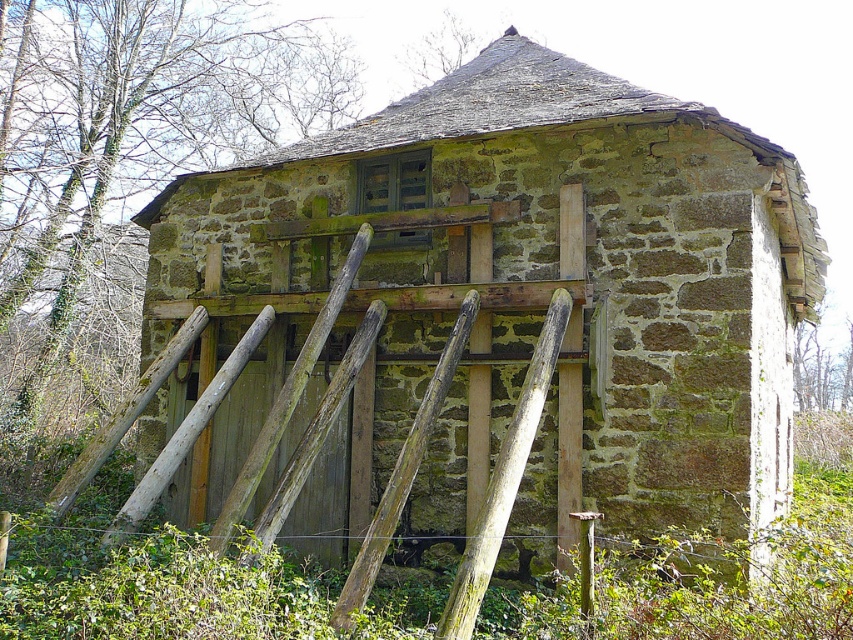
You are a carpenter assessing the stability of the old stone building. You notice two wooden supports in front of the building. Which one is shorter, the smooth wooden plank at center or the weathered wood at center?

The smooth wooden plank at center is shorter than the weathered wood at center.

You are standing in front of the old stone building and want to place a new support beam. The coordinates of the current wooden plank are at point 0.748, 0.592. Where should you place the new beam relative to the existing smooth wooden plank at center to ensure stability?

The smooth wooden plank at center is located at point [503,477]. To ensure stability, the new beam should be placed adjacent to or overlapping with this coordinate to reinforce the existing support.